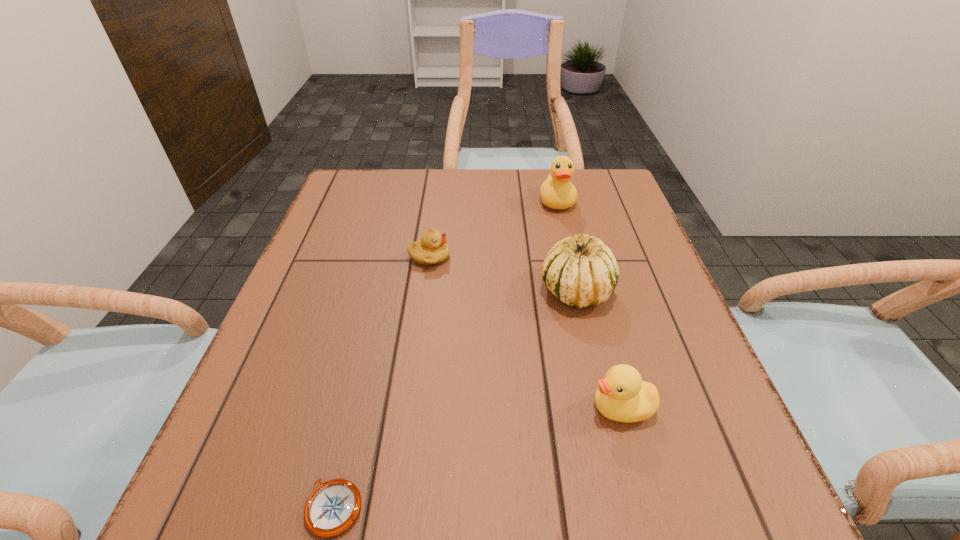
The image size is (960, 540). In order to click on the taller duck in this screenshot , I will do `click(557, 192)`.

Find the location of a particular element. The width and height of the screenshot is (960, 540). the farthest object is located at coordinates (557, 192).

This screenshot has width=960, height=540. I want to click on gourd, so click(581, 271).

Find the location of a particular element. the nearer duck is located at coordinates (622, 396).

I want to click on the shorter duck, so click(622, 396).

You are a GUI agent. You are given a task and a screenshot of the screen. Output one action in this format:
    pyautogui.click(x=<x>, y=<y>)
    Task: Click on the duckling
    The height and width of the screenshot is (540, 960).
    Given the screenshot: What is the action you would take?
    pyautogui.click(x=432, y=249)

I want to click on the shortest object, so click(x=331, y=509).

Where is `compass`? compass is located at coordinates (331, 509).

Where is `free space located at the beak of the taller duck`? Image resolution: width=960 pixels, height=540 pixels. free space located at the beak of the taller duck is located at coordinates (566, 241).

This screenshot has width=960, height=540. Find the location of `vacant space located on the front of the gourd`. vacant space located on the front of the gourd is located at coordinates (587, 336).